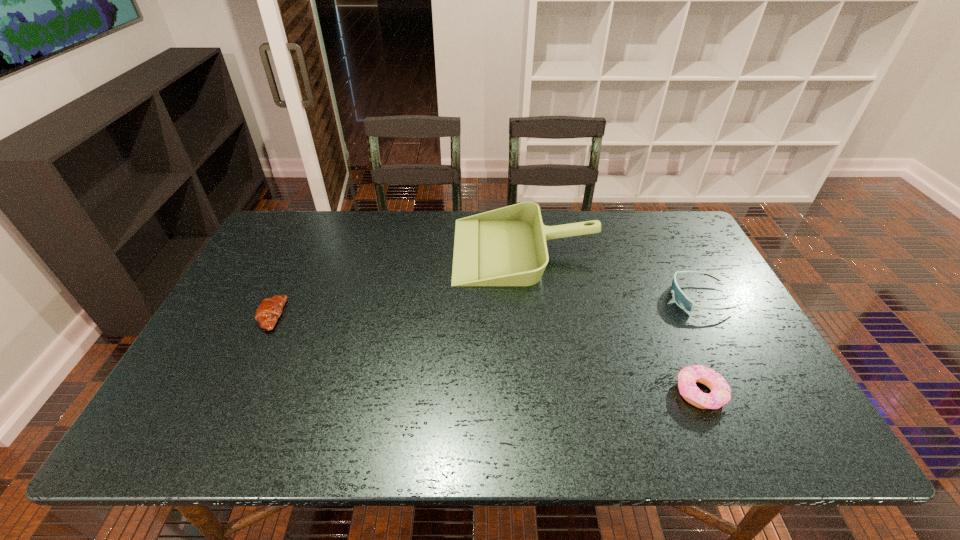
This screenshot has height=540, width=960. Identify the location of dustpan. (507, 246).

Where is `the second object from left to right`? The width and height of the screenshot is (960, 540). the second object from left to right is located at coordinates (507, 246).

The width and height of the screenshot is (960, 540). I want to click on the third shortest object, so 680,298.

Locate an element on the screen. crescent roll is located at coordinates (269, 310).

This screenshot has height=540, width=960. Find the location of `doughnut`. doughnut is located at coordinates (720, 394).

Image resolution: width=960 pixels, height=540 pixels. What are the coordinates of `free space located on the scoop of the second object from left to right` in the screenshot? It's located at (416, 250).

At what (x,y) coordinates should I click in order to perform the action: click on blank space located 0.330m on the scoop of the second object from left to right. Please return your answer as a coordinate pair (x, y). Looking at the image, I should click on (349, 250).

Find the location of `vacant space located 0.220m on the scoop of the second object from left to right`. vacant space located 0.220m on the scoop of the second object from left to right is located at coordinates (384, 250).

Locate an element on the screen. Image resolution: width=960 pixels, height=540 pixels. free location located 0.380m on the front-facing side of the goggles is located at coordinates (535, 298).

Identify the location of blank space located on the front-facing side of the goggles. (652, 298).